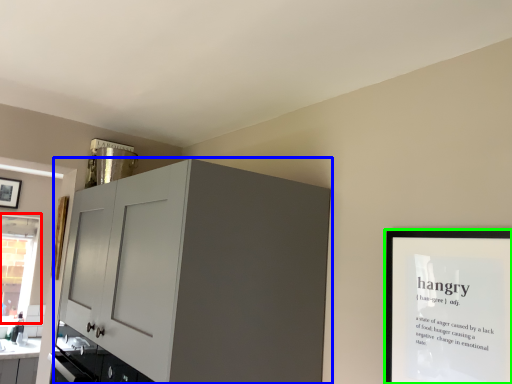
Question: Considering the real-world distances, which object is farthest from window (highlighted by a red box)? cabinetry (highlighted by a blue box) or picture frame (highlighted by a green box)?

Choices:
 (A) cabinetry
 (B) picture frame

Answer: (B)